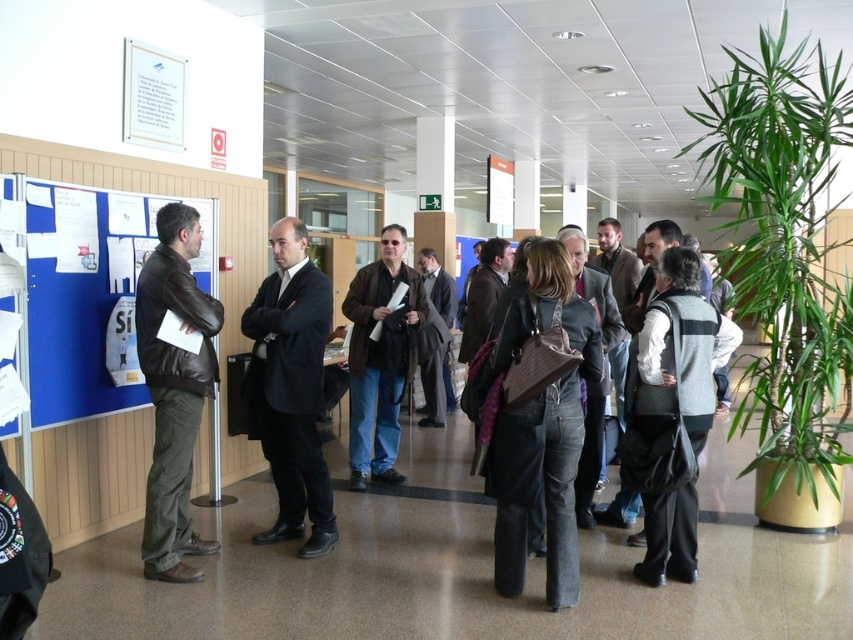
Question: Which object appears farthest from the camera in this image?

Choices:
 (A) black suit at center
 (B) blue fabric bulletin board at left
 (C) dark gray suit at center

Answer: (C)

Question: Can you confirm if denim jeans at center is wider than matte brown leather jacket at left?

Choices:
 (A) no
 (B) yes

Answer: (B)

Question: Can you confirm if gray wool vest at center-right is positioned below matte brown jacket at center?

Choices:
 (A) no
 (B) yes

Answer: (B)

Question: Can you confirm if matte brown jacket at center is positioned above white glossy poster at upper left?

Choices:
 (A) no
 (B) yes

Answer: (A)

Question: Which point is farther to the camera?

Choices:
 (A) white paper at upper center
 (B) matte brown leather jacket at left
 (C) denim jeans at center

Answer: (A)

Question: Which is farther from the matte brown leather jacket at left?

Choices:
 (A) black suit at center
 (B) blue fabric bulletin board at left

Answer: (B)